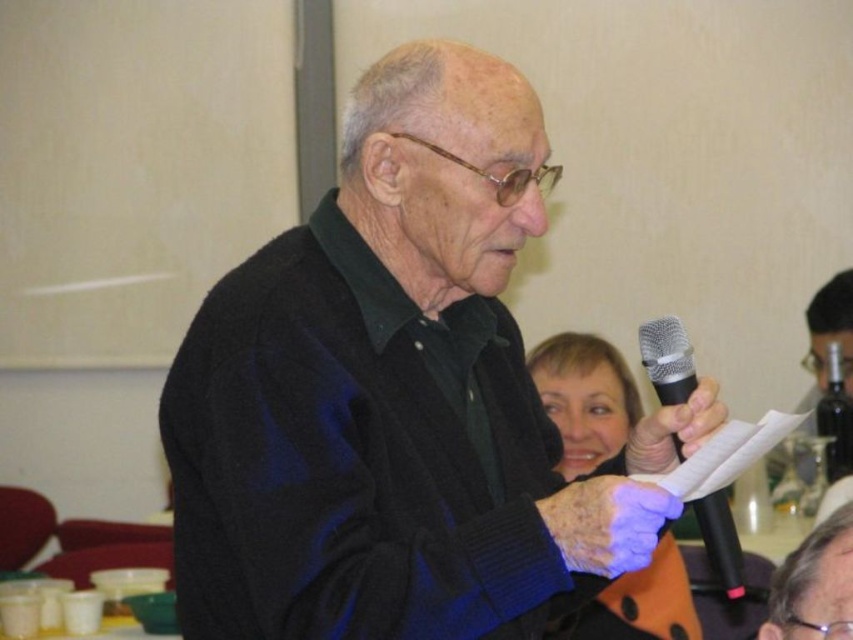
Which is in front, point (618, 488) or point (670, 429)?

Point (618, 488) is more forward.

Is point (584, 561) farther from camera compared to point (721, 403)?

No.

Who is more distant from viewer, (549, 518) or (672, 433)?

The point (672, 433) is behind.

Find the location of a particular element. The width and height of the screenshot is (853, 640). purple leather glove at center is located at coordinates (606, 524).

Can you confirm if black metallic microphone at center is shorter than black matte microphone at center?

In fact, black metallic microphone at center may be taller than black matte microphone at center.

I want to click on black metallic microphone at center, so click(666, 358).

How far apart are matte black microphone at center and black metallic microphone at center?

1.24 meters

Between matte black microphone at center and black metallic microphone at center, which one is positioned lower?

Positioned lower is matte black microphone at center.

Is point (619, 365) positioned behind point (680, 326)?

Yes.

You are a GUI agent. You are given a task and a screenshot of the screen. Output one action in this format:
    pyautogui.click(x=<x>, y=<y>)
    Task: Click on the matte black microphone at center
    This screenshot has height=640, width=853.
    Given the screenshot: What is the action you would take?
    coord(585,397)